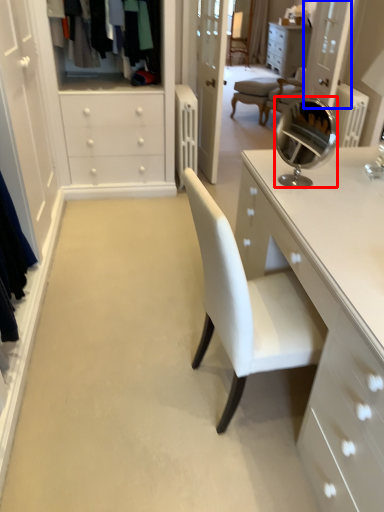
Question: Which point is closer to the camera, mirror (highlighted by a red box) or glass door (highlighted by a blue box)?

Choices:
 (A) mirror
 (B) glass door

Answer: (A)